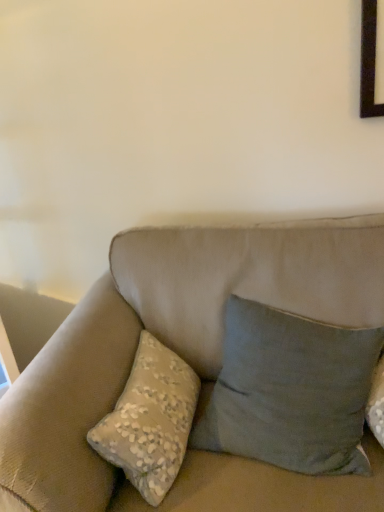
This screenshot has height=512, width=384. Identify the location of matte gray pillow at center. (290, 391).

What do you see at coordinates (290, 391) in the screenshot? I see `matte gray pillow at center` at bounding box center [290, 391].

From the picture: Measure the distance between point (194, 421) and camera.

The distance of point (194, 421) from camera is 3.97 feet.

Locate an element on the screen. This screenshot has height=512, width=384. matte gray pillow at center is located at coordinates (290, 391).